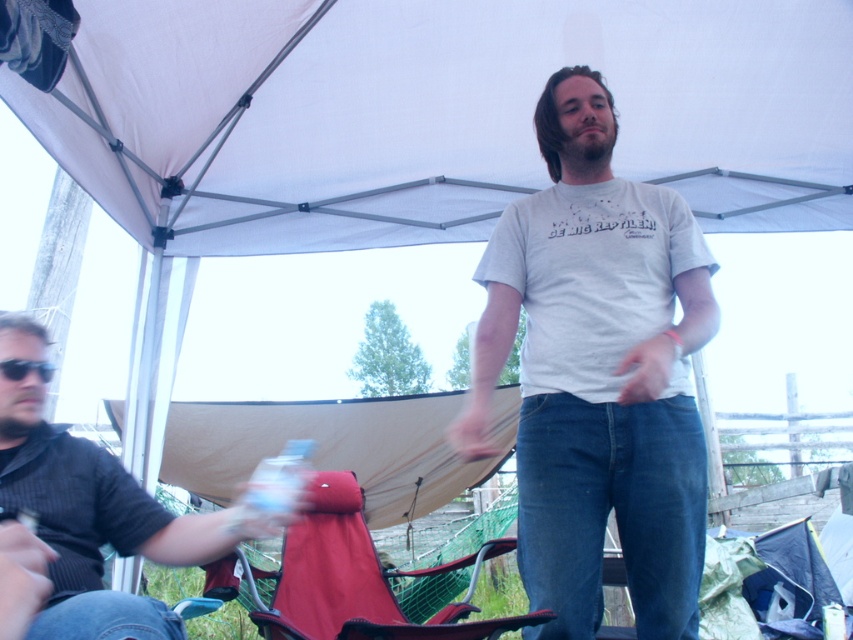
Question: Does white cotton t-shirt at center appear under matte red folding chair at lower center?

Choices:
 (A) no
 (B) yes

Answer: (A)

Question: Estimate the real-world distances between objects in this image. Which object is closer to the black knitwear at left?

Choices:
 (A) white fabric canopy at center
 (B) white cotton t-shirt at center
 (C) matte red folding chair at lower center

Answer: (B)

Question: Does white fabric canopy at center appear under matte red folding chair at lower center?

Choices:
 (A) yes
 (B) no

Answer: (B)

Question: Which object appears closest to the camera in this image?

Choices:
 (A) white cotton t-shirt at center
 (B) matte red folding chair at lower center
 (C) black knitwear at left

Answer: (C)

Question: Is white fabric canopy at center further to camera compared to black plastic sunglasses at left?

Choices:
 (A) no
 (B) yes

Answer: (B)

Question: Which point is farther to the camera?

Choices:
 (A) (537, 164)
 (B) (51, 470)

Answer: (A)